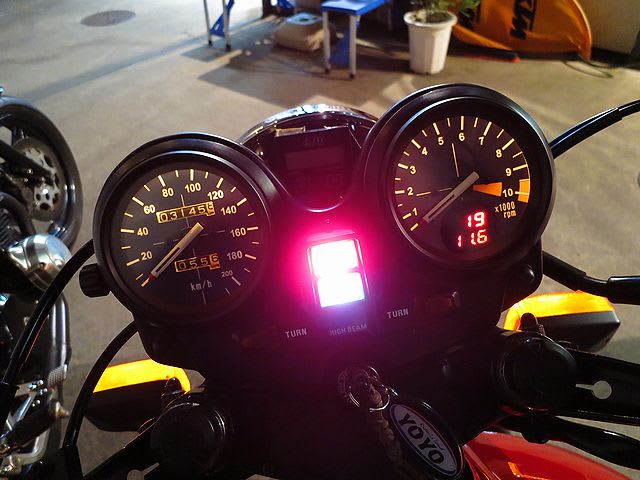
The width and height of the screenshot is (640, 480). In order to click on pot in this screenshot , I will do `click(431, 64)`.